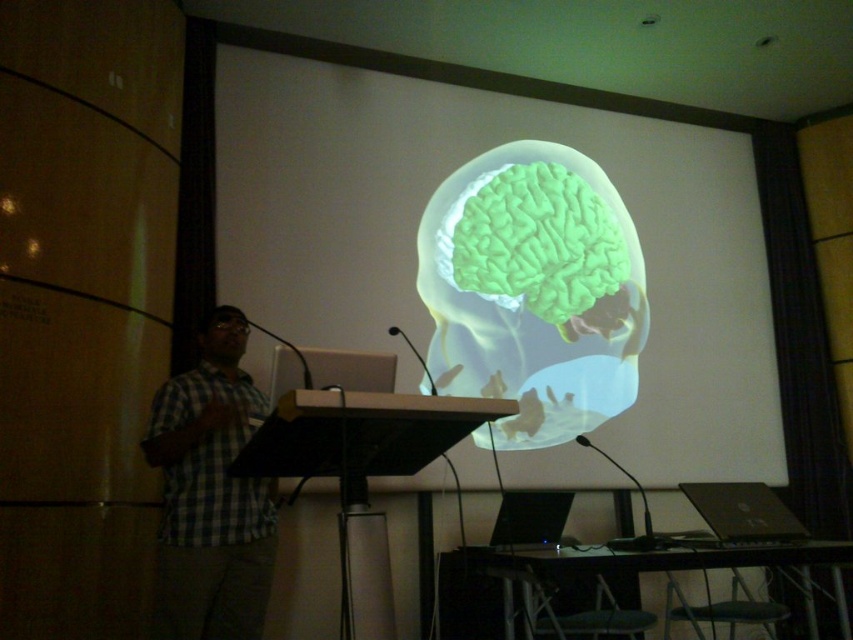
Question: Which point is farther from the camera taking this photo?

Choices:
 (A) (171, 616)
 (B) (515, 493)
 (C) (335, 218)

Answer: (C)

Question: Can you confirm if transparent plastic brain at center is bigger than checkered fabric shirt at left?

Choices:
 (A) yes
 (B) no

Answer: (A)

Question: Considering the real-world distances, which object is closest to the black plastic laptop at lower right?

Choices:
 (A) transparent plastic brain at center
 (B) black plastic laptop at lower center

Answer: (B)

Question: Can you confirm if transparent plastic brain at center is wider than black plastic laptop at lower right?

Choices:
 (A) no
 (B) yes

Answer: (B)

Question: Is transparent plastic brain at center behind black plastic laptop at lower center?

Choices:
 (A) no
 (B) yes

Answer: (B)

Question: Estimate the real-world distances between objects in this image. Which object is closer to the checkered fabric shirt at left?

Choices:
 (A) black plastic laptop at lower right
 (B) transparent plastic brain at center

Answer: (B)